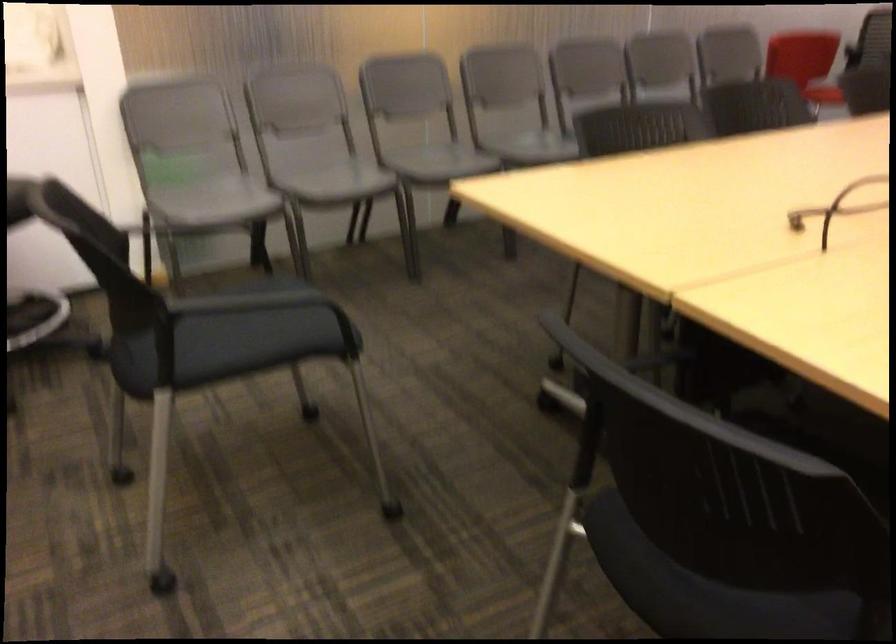
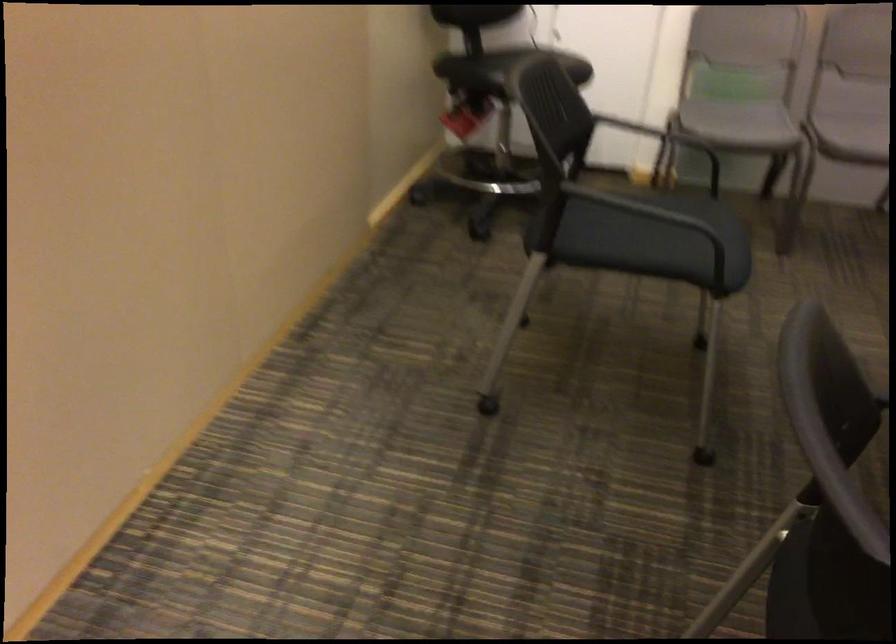
Find the pixel in the second image that matches point 254,339 in the first image.

(655, 240)